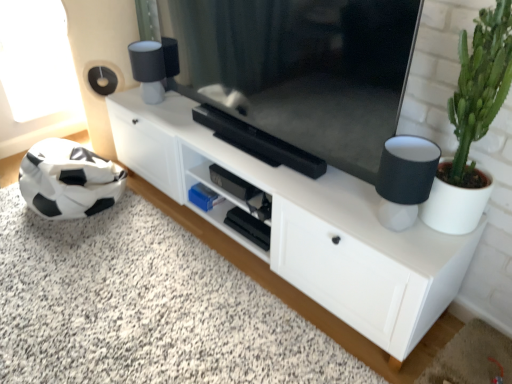
This screenshot has height=384, width=512. What are the coordinates of `vacant space in front of green succulent at right` in the screenshot? It's located at 432,254.